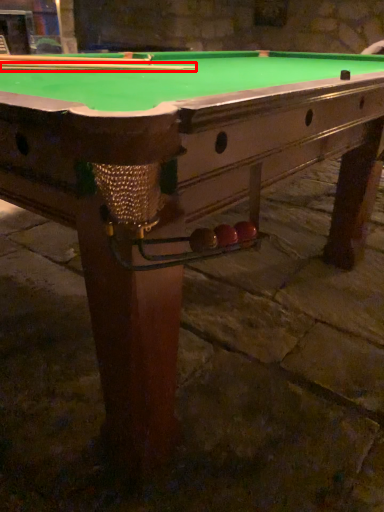
Question: From the image's perspective, where is cue (annotated by the red box) located in relation to cue in the image?

Choices:
 (A) above
 (B) below

Answer: (B)